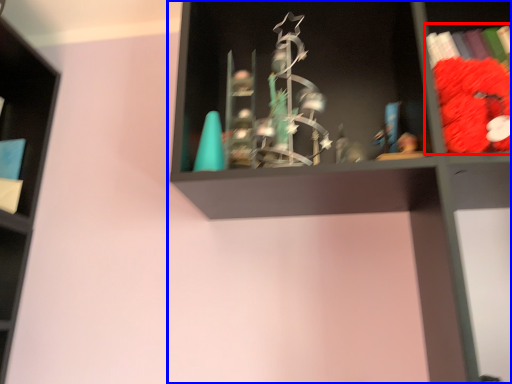
Question: Among these objects, which one is nearest to the camera, book (highlighted by a red box) or shelf (highlighted by a blue box)?

Choices:
 (A) book
 (B) shelf

Answer: (B)